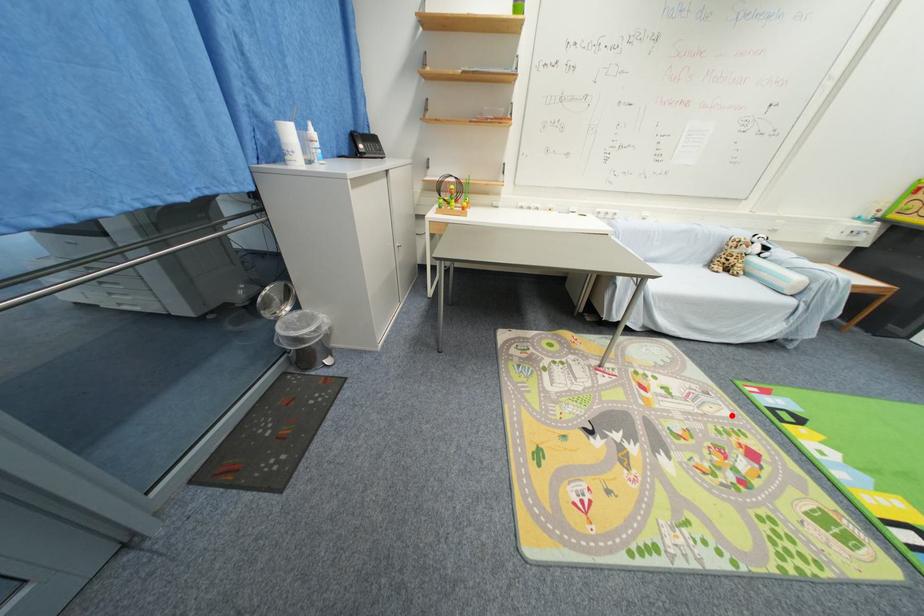
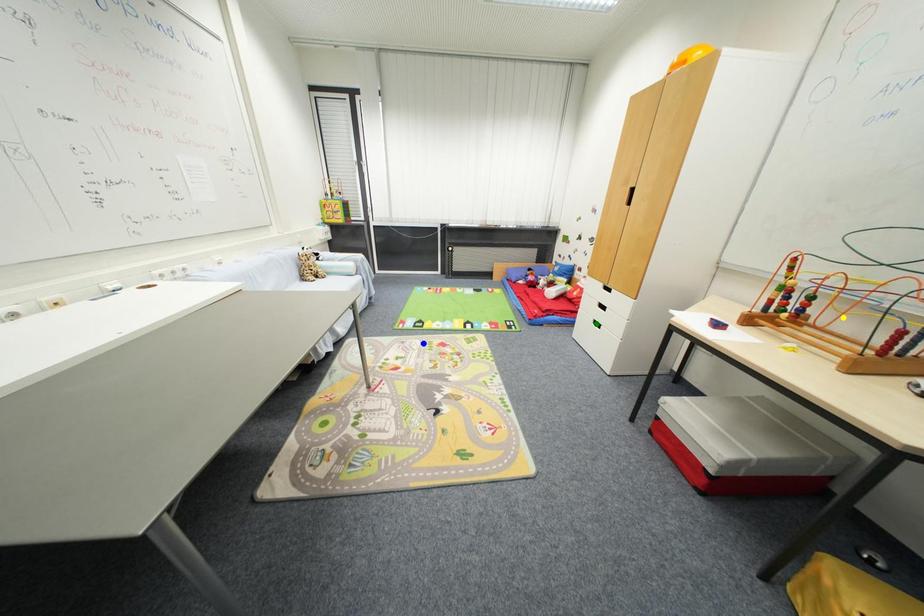
Question: I am providing you with two images of the same scene from different viewpoints. A red point is marked on the first image. You are given multiple points on the second image. Which mark in image 2 goes with the point in image 1?

Choices:
 (A) blue point
 (B) green point
 (C) yellow point

Answer: (A)